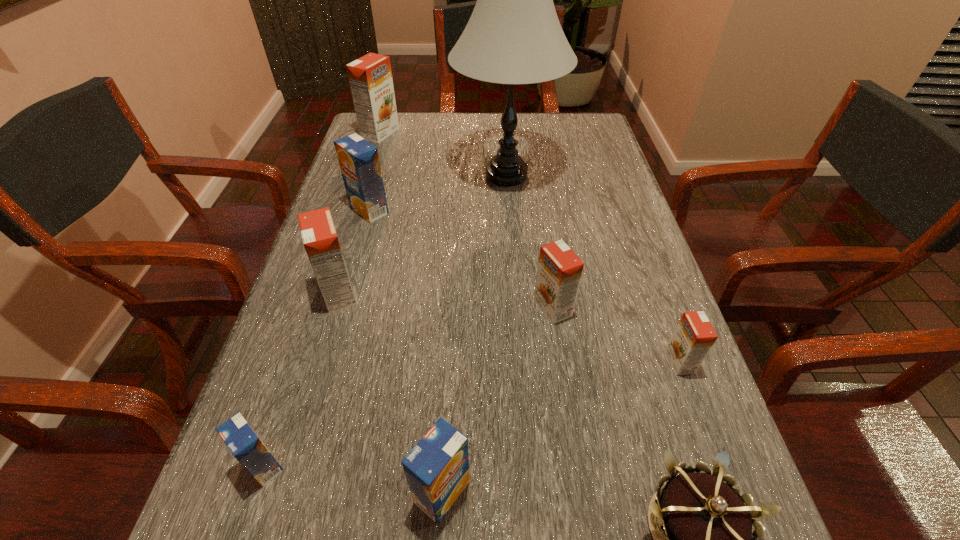
Locate an element on the screen. the tallest object is located at coordinates (514, 36).

What are the coordinates of `black lamp` in the screenshot? It's located at (514, 36).

What are the coordinates of `the farthest orange juice` in the screenshot? It's located at (370, 77).

You are a GUI agent. You are given a task and a screenshot of the screen. Output one action in this format:
    pyautogui.click(x=<x>, y=<y>)
    Task: Click on the farthest object
    This screenshot has height=540, width=960.
    Given the screenshot: What is the action you would take?
    pyautogui.click(x=370, y=77)

The image size is (960, 540). I want to click on the second farthest orange juice, so click(359, 162).

Where is `the farthest blue orange_juice`? The height and width of the screenshot is (540, 960). the farthest blue orange_juice is located at coordinates (359, 162).

You are a GUI agent. You are given a task and a screenshot of the screen. Output one action in this format:
    pyautogui.click(x=<x>, y=<y>)
    Task: Click on the second biggest orange orange juice
    
    Given the screenshot: What is the action you would take?
    pyautogui.click(x=320, y=240)

Identify the location of the second orange orange juice from right to left. coord(559,272).

What are the coordinates of `the second orange juice from right to left` in the screenshot? It's located at (559, 272).

The width and height of the screenshot is (960, 540). I want to click on the second smallest blue orange_juice, so click(437, 468).